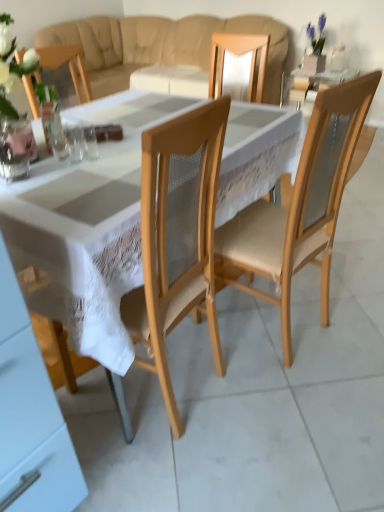
The height and width of the screenshot is (512, 384). Find the location of `free area behind white glossy cabinet at lower left`. free area behind white glossy cabinet at lower left is located at coordinates (106, 449).